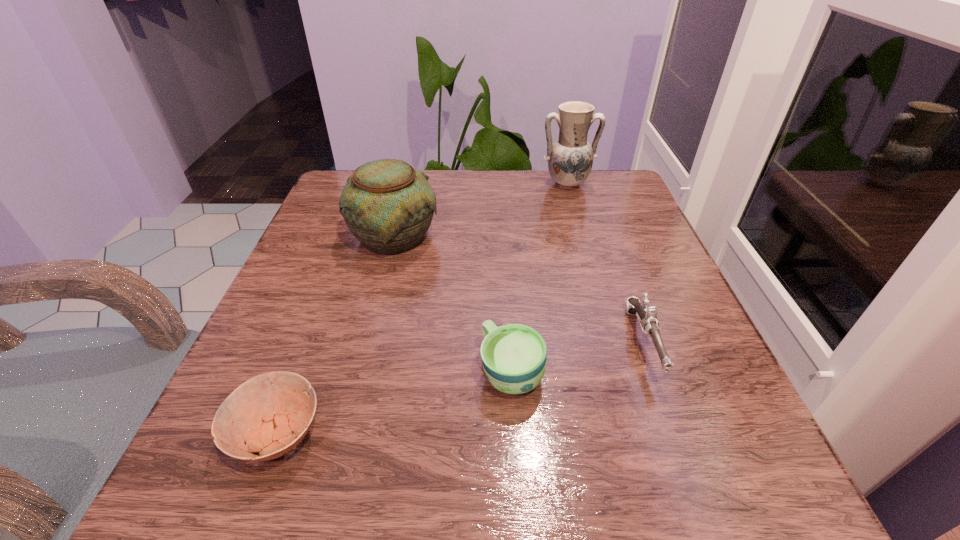
Identify the location of vacant space located 0.270m on the right of the third object from left to right. (717, 372).

Where is `vacant space located 0.310m on the back of the shortest object`? vacant space located 0.310m on the back of the shortest object is located at coordinates (342, 263).

I want to click on object that is at the near edge, so click(x=264, y=412).

At what (x,y) coordinates should I click in order to perform the action: click on pottery present at the left edge. Please return your answer as a coordinate pair (x, y). Looking at the image, I should click on (387, 205).

The height and width of the screenshot is (540, 960). I want to click on bowl that is at the left edge, so click(x=264, y=412).

Where is `pottery located at the right edge`? The image size is (960, 540). pottery located at the right edge is located at coordinates (570, 159).

The width and height of the screenshot is (960, 540). I want to click on gun that is positioned at the right edge, so click(x=648, y=316).

Where is `object located at the far left corner`? The image size is (960, 540). object located at the far left corner is located at coordinates (387, 205).

Image resolution: width=960 pixels, height=540 pixels. Find the location of `object located in the near left corner section of the desktop`. object located in the near left corner section of the desktop is located at coordinates (264, 412).

Locate an element on the screen. This screenshot has width=960, height=540. object situated at the far right corner is located at coordinates [570, 159].